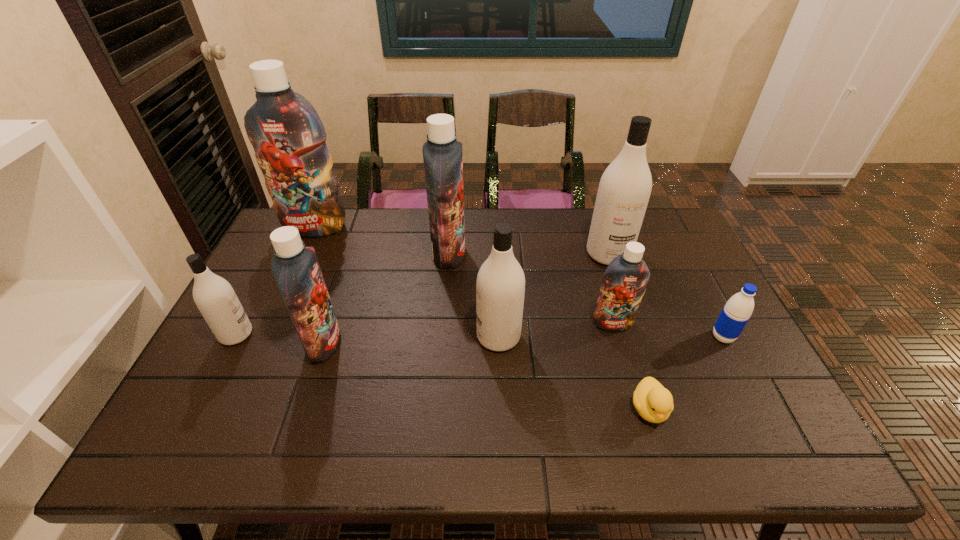
This screenshot has width=960, height=540. Find the location of `the leftmost white shampoo`. the leftmost white shampoo is located at coordinates (215, 298).

The width and height of the screenshot is (960, 540). Find the location of `the smallest blue shampoo`. the smallest blue shampoo is located at coordinates pos(624,283).

I want to click on the rightmost object, so pos(738,309).

Where is `blue water bottle`? The width and height of the screenshot is (960, 540). blue water bottle is located at coordinates (738, 309).

Where is `the nearest object`? The height and width of the screenshot is (540, 960). the nearest object is located at coordinates (654, 403).

You are a GUI agent. You are given a task and a screenshot of the screen. Output one action in this format:
    pyautogui.click(x=<x>, y=<y>)
    Task: Click on the duck
    The width and height of the screenshot is (960, 540).
    Given the screenshot: What is the action you would take?
    pyautogui.click(x=654, y=403)

I want to click on free location located 0.260m on the front label of the tallest object, so pyautogui.click(x=285, y=294).

Where is `vacant space located on the front label of the fourth object from left to right`? This screenshot has width=960, height=540. vacant space located on the front label of the fourth object from left to right is located at coordinates (586, 253).

Where is `vacant space located on the front-facing side of the rightmost white shampoo`? vacant space located on the front-facing side of the rightmost white shampoo is located at coordinates (636, 339).

Where is `free space located on the front label of the second smallest blue shampoo`? free space located on the front label of the second smallest blue shampoo is located at coordinates (386, 343).